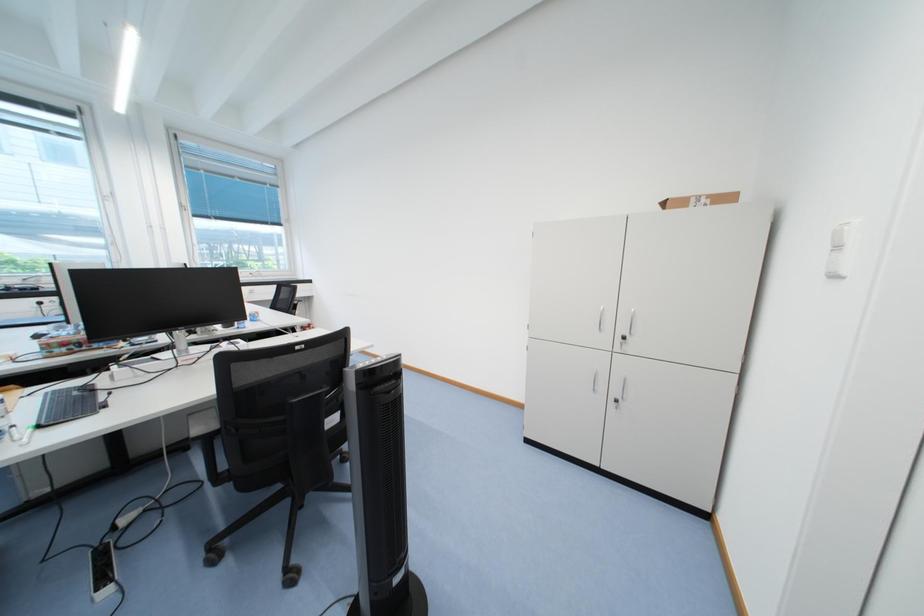
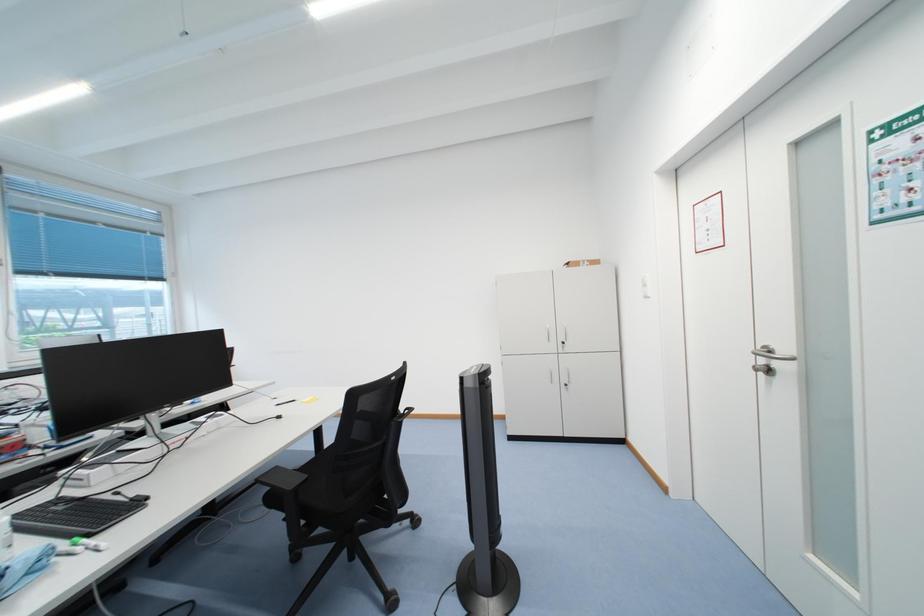
Question: The first image is from the beginning of the video and the second image is from the end. How did the camera likely rotate when shooting the video?

Choices:
 (A) Left
 (B) Right
 (C) Up
 (D) Down

Answer: (B)